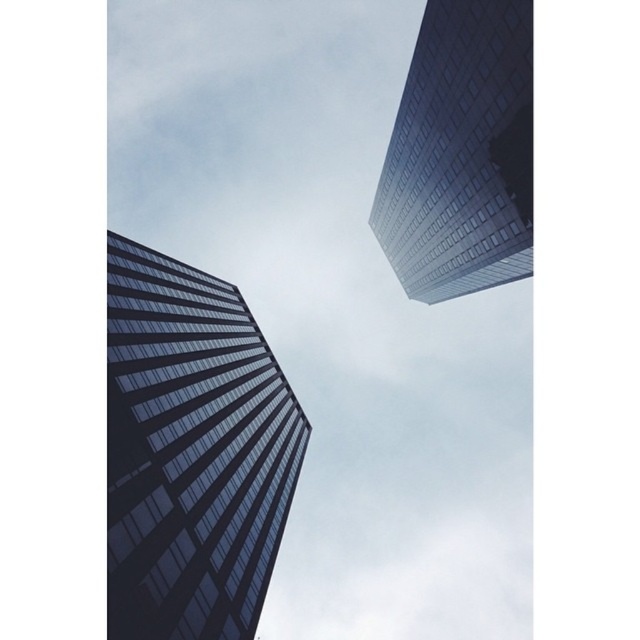
Question: Among these objects, which one is farthest from the camera?

Choices:
 (A) glassy reflective skyscraper at upper right
 (B) glassy reflective skyscraper at center

Answer: (A)

Question: Which point appears closest to the camera in this image?

Choices:
 (A) (182, 380)
 (B) (525, 116)

Answer: (B)

Question: Does glassy reflective skyscraper at center appear over glassy reflective skyscraper at upper right?

Choices:
 (A) yes
 (B) no

Answer: (B)

Question: Is glassy reflective skyscraper at center wider than glassy reflective skyscraper at upper right?

Choices:
 (A) yes
 (B) no

Answer: (A)

Question: Is glassy reflective skyscraper at center positioned before glassy reflective skyscraper at upper right?

Choices:
 (A) no
 (B) yes

Answer: (B)